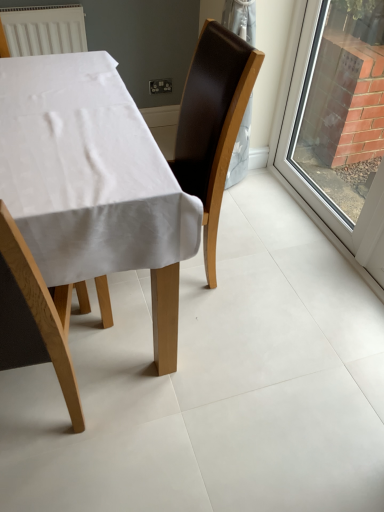
Question: Is wooden chair at lower left, which is counted as the second chair, starting from the back, spatially inside white fabric-covered table at center, or outside of it?

Choices:
 (A) inside
 (B) outside

Answer: (A)

Question: Looking at their shapes, would you say wooden chair at lower left, the first chair viewed from the front, is wider or thinner than white fabric-covered table at center?

Choices:
 (A) wide
 (B) thin

Answer: (B)

Question: Estimate the real-world distances between objects in this image. Which object is closer to the white fabric-covered table at center?

Choices:
 (A) brown leather chair at center, the first chair positioned from the back
 (B) wooden chair at lower left, the first chair viewed from the front
 (C) clear glass window at right

Answer: (B)

Question: Considering the real-world distances, which object is farthest from the wooden chair at lower left, which is counted as the second chair, starting from the back?

Choices:
 (A) white fabric-covered table at center
 (B) clear glass window at right
 (C) brown leather chair at center, the first chair positioned from the back

Answer: (B)